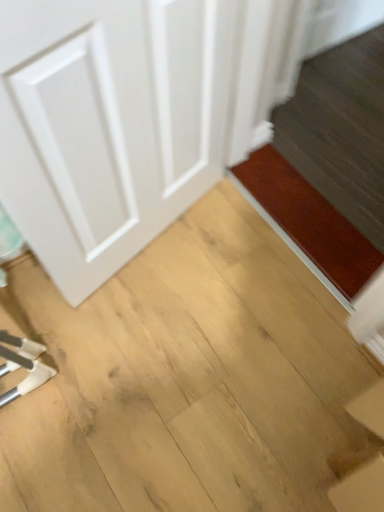
Question: Is brown matte doormat at lower right oriented towards light brown wood at center?

Choices:
 (A) no
 (B) yes

Answer: (A)

Question: Is light brown wood at center inside brown matte doormat at lower right?

Choices:
 (A) no
 (B) yes

Answer: (A)

Question: Does brown matte doormat at lower right have a lesser height compared to light brown wood at center?

Choices:
 (A) no
 (B) yes

Answer: (B)

Question: Is brown matte doormat at lower right outside of light brown wood at center?

Choices:
 (A) yes
 (B) no

Answer: (A)

Question: Is there a large distance between brown matte doormat at lower right and light brown wood at center?

Choices:
 (A) no
 (B) yes

Answer: (A)

Question: In terms of height, does white matte door at left look taller or shorter compared to light brown wood at center?

Choices:
 (A) short
 (B) tall

Answer: (B)

Question: Would you say white matte door at left is inside or outside light brown wood at center?

Choices:
 (A) inside
 (B) outside

Answer: (B)

Question: In terms of width, does white matte door at left look wider or thinner when compared to light brown wood at center?

Choices:
 (A) thin
 (B) wide

Answer: (A)

Question: Is white matte door at left bigger or smaller than light brown wood at center?

Choices:
 (A) small
 (B) big

Answer: (A)

Question: From a real-world perspective, is white matte door at left positioned above or below brown matte doormat at lower right?

Choices:
 (A) below
 (B) above

Answer: (B)

Question: In the image, is white matte door at left on the left side or the right side of brown matte doormat at lower right?

Choices:
 (A) left
 (B) right

Answer: (A)

Question: From the image's perspective, is white matte door at left above or below brown matte doormat at lower right?

Choices:
 (A) below
 (B) above

Answer: (B)

Question: Based on their sizes in the image, would you say white matte door at left is bigger or smaller than brown matte doormat at lower right?

Choices:
 (A) big
 (B) small

Answer: (A)

Question: Is brown matte doormat at lower right inside or outside of light brown wood at center?

Choices:
 (A) outside
 (B) inside

Answer: (A)

Question: Is brown matte doormat at lower right wider or thinner than light brown wood at center?

Choices:
 (A) thin
 (B) wide

Answer: (A)